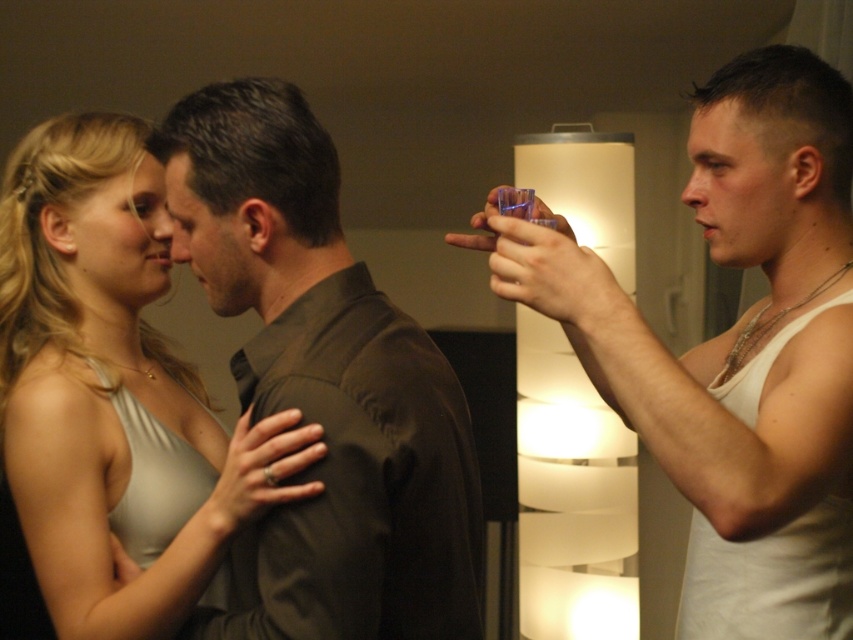
What do you see at coordinates (325, 381) in the screenshot? The height and width of the screenshot is (640, 853). I see `matte brown shirt at center` at bounding box center [325, 381].

Is matte brown shirt at center positioned at the back of matte silver dress at center?

No.

This screenshot has width=853, height=640. What do you see at coordinates (325, 381) in the screenshot?
I see `matte brown shirt at center` at bounding box center [325, 381].

Image resolution: width=853 pixels, height=640 pixels. I want to click on matte brown shirt at center, so click(325, 381).

Between point (689, 456) and point (126, 628), which one is positioned behind?

The point (126, 628) is more distant.

Does point (825, 385) come behind point (64, 483)?

No, it is in front of (64, 483).

Locate an element on the screen. The image size is (853, 640). translucent plastic cup at right is located at coordinates (735, 349).

Locate an element on the screen. The width and height of the screenshot is (853, 640). translucent plastic cup at right is located at coordinates (735, 349).

Is translucent plastic cup at right further to camera compared to matte brown shirt at center?

That is False.

Who is positioned more to the right, translucent plastic cup at right or matte brown shirt at center?

translucent plastic cup at right

The height and width of the screenshot is (640, 853). I want to click on translucent plastic cup at right, so click(735, 349).